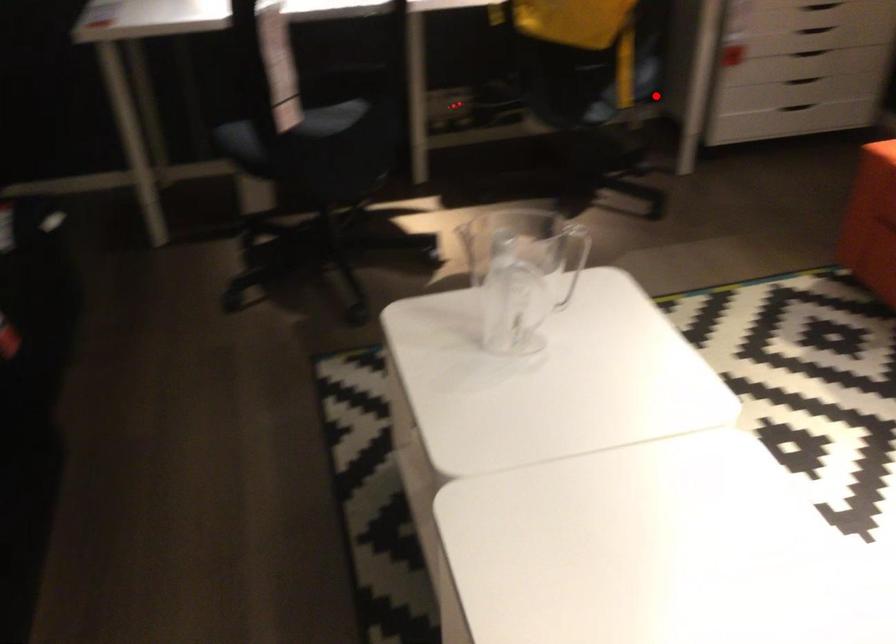
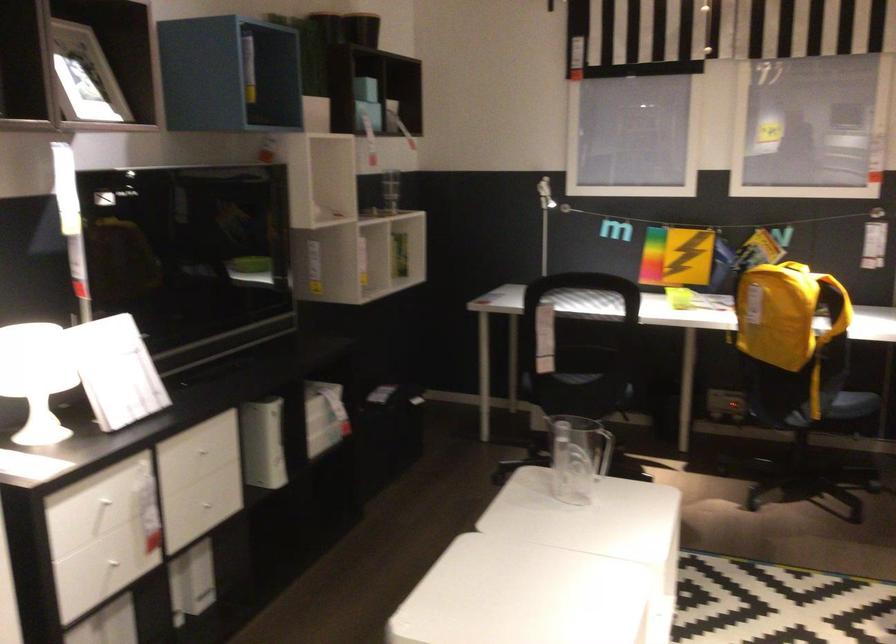
Where in the second image is the point corresponding to the highlighted location from the first image?

(854, 404)